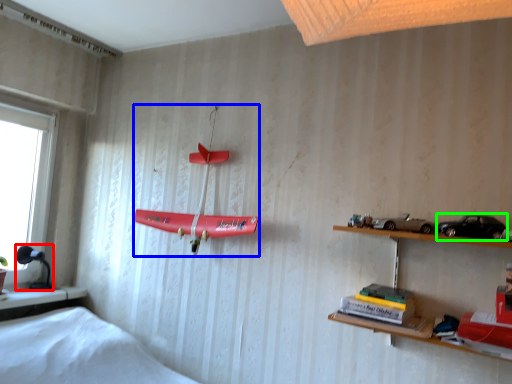
Question: Considering the real-world distances, which object is farthest from lamp (highlighted by a red box)? toy (highlighted by a blue box) or toy car (highlighted by a green box)?

Choices:
 (A) toy
 (B) toy car

Answer: (B)